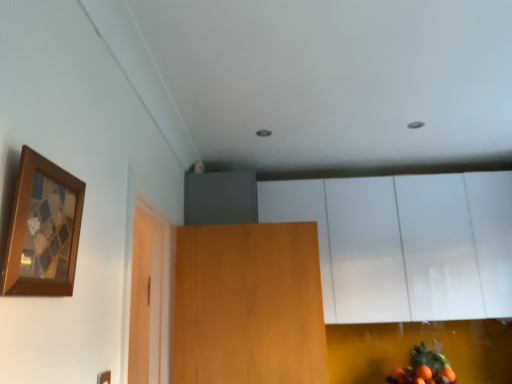
Question: Is the depth of wooden door at center less than that of white glossy cabinet at upper center?

Choices:
 (A) yes
 (B) no

Answer: (A)

Question: Could you tell me if wooden door at center is turned towards white glossy cabinet at upper center?

Choices:
 (A) no
 (B) yes

Answer: (A)

Question: Is the depth of wooden door at center greater than that of white glossy cabinet at upper center?

Choices:
 (A) yes
 (B) no

Answer: (B)

Question: Does wooden door at center have a lesser width compared to white glossy cabinet at upper center?

Choices:
 (A) no
 (B) yes

Answer: (B)

Question: Does wooden door at center have a greater height compared to white glossy cabinet at upper center?

Choices:
 (A) no
 (B) yes

Answer: (A)

Question: Is wooden door at center smaller than white glossy cabinet at upper center?

Choices:
 (A) yes
 (B) no

Answer: (A)

Question: From the image's perspective, is orange matte fruit at lower right on top of wooden picture frame at upper left?

Choices:
 (A) no
 (B) yes

Answer: (A)

Question: Is orange matte fruit at lower right positioned with its back to wooden picture frame at upper left?

Choices:
 (A) yes
 (B) no

Answer: (B)

Question: Is orange matte fruit at lower right positioned beyond the bounds of wooden picture frame at upper left?

Choices:
 (A) yes
 (B) no

Answer: (A)

Question: Does orange matte fruit at lower right come in front of wooden picture frame at upper left?

Choices:
 (A) no
 (B) yes

Answer: (A)

Question: Considering the relative positions of orange matte fruit at lower right and wooden picture frame at upper left in the image provided, is orange matte fruit at lower right to the right of wooden picture frame at upper left from the viewer's perspective?

Choices:
 (A) no
 (B) yes

Answer: (B)

Question: Considering the relative positions of orange matte fruit at lower right and wooden picture frame at upper left in the image provided, is orange matte fruit at lower right to the left of wooden picture frame at upper left from the viewer's perspective?

Choices:
 (A) no
 (B) yes

Answer: (A)

Question: From a real-world perspective, does orange matte fruit at lower right stand above wooden door at center?

Choices:
 (A) no
 (B) yes

Answer: (A)